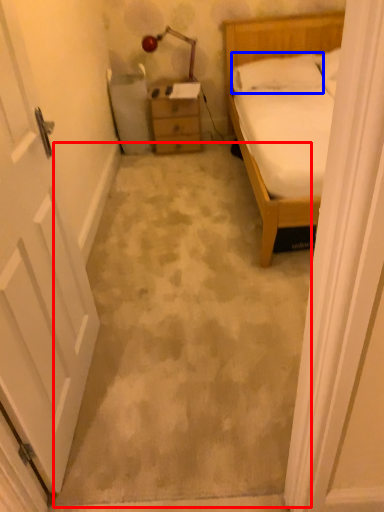
Question: Which point is further to the camera, concrete (highlighted by a red box) or pillow (highlighted by a blue box)?

Choices:
 (A) concrete
 (B) pillow

Answer: (B)